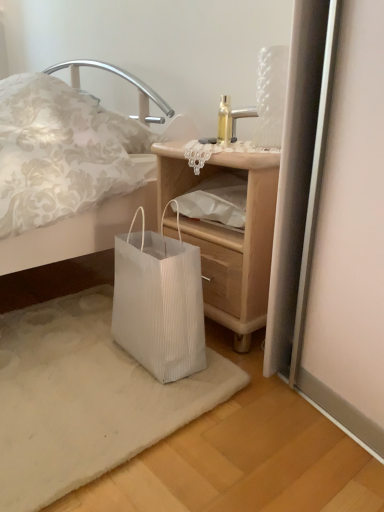
Image resolution: width=384 pixels, height=512 pixels. What do you see at coordinates (159, 303) in the screenshot?
I see `white paper bag at lower left` at bounding box center [159, 303].

Where is `white pleated paper bag at lower left`? This screenshot has height=512, width=384. white pleated paper bag at lower left is located at coordinates (84, 399).

Locate an element on the screen. The height and width of the screenshot is (512, 384). white paper bag at lower left is located at coordinates (159, 303).

From the picture: From a real-world perspective, is white paper bag at lower left physically above white pleated paper bag at lower left?

Yes, from a real-world perspective, white paper bag at lower left is on top of white pleated paper bag at lower left.

From the image's perspective, is white paper bag at lower left above or below white pleated paper bag at lower left?

white paper bag at lower left is above white pleated paper bag at lower left.

From the picture: Does white paper bag at lower left appear on the right side of white pleated paper bag at lower left?

Yes, white paper bag at lower left is to the right of white pleated paper bag at lower left.

Based on the photo, which is in front, white paper bag at lower left or white pleated paper bag at lower left?

Positioned in front is white pleated paper bag at lower left.

You are a GUI agent. You are given a task and a screenshot of the screen. Output one action in this format:
    pyautogui.click(x=<x>, y=<y>)
    Task: Click on the nightstand that is behind the white paper bag at lower left
    This screenshot has width=384, height=512.
    Given the screenshot: What is the action you would take?
    pyautogui.click(x=228, y=234)

Are white paper bag at lower left and wooden nightstand at lower center located far from each other?

They are positioned close to each other.

From a real-world perspective, is white paper bag at lower left physically located above or below wooden nightstand at lower center?

From a real-world perspective, white paper bag at lower left is physically below wooden nightstand at lower center.

How far apart are white paper bag at lower left and wooden nightstand at lower center?

7.53 inches.

In the scene shown: How far apart are white pleated paper bag at lower left and wooden nightstand at lower center?

They are 14.49 inches apart.

From a real-world perspective, is white pleated paper bag at lower left under wooden nightstand at lower center?

Correct, in the physical world, white pleated paper bag at lower left is lower than wooden nightstand at lower center.

From the picture: Considering the sizes of objects white pleated paper bag at lower left and wooden nightstand at lower center in the image provided, who is taller, white pleated paper bag at lower left or wooden nightstand at lower center?

wooden nightstand at lower center.

In the scene shown: Considering the relative positions of white pleated paper bag at lower left and wooden nightstand at lower center in the image provided, is white pleated paper bag at lower left in front of wooden nightstand at lower center?

Yes, white pleated paper bag at lower left is closer to the viewer.

Is wooden nightstand at lower center closer to camera compared to white pleated paper bag at lower left?

No, the depth of wooden nightstand at lower center is greater than that of white pleated paper bag at lower left.

Is wooden nightstand at lower center facing towards white pleated paper bag at lower left?

Yes, wooden nightstand at lower center is turned towards white pleated paper bag at lower left.

Which object is positioned more to the right, wooden nightstand at lower center or white pleated paper bag at lower left?

wooden nightstand at lower center.

Are wooden nightstand at lower center and white paper bag at lower left far apart?

No, wooden nightstand at lower center is in close proximity to white paper bag at lower left.

Would you say wooden nightstand at lower center is outside white paper bag at lower left?

Absolutely, wooden nightstand at lower center is external to white paper bag at lower left.

From a real-world perspective, is wooden nightstand at lower center physically located above or below white paper bag at lower left?

In terms of real-world spatial position, wooden nightstand at lower center is above white paper bag at lower left.

Between point (101, 434) and point (159, 380), which one is positioned behind?

The point (159, 380) is behind.

Can you tell me how much white pleated paper bag at lower left and white paper bag at lower left differ in facing direction?

The facing directions of white pleated paper bag at lower left and white paper bag at lower left are 91.3 degrees apart.

From the image's perspective, would you say white pleated paper bag at lower left is shown under white paper bag at lower left?

Yes, from the image's perspective, white pleated paper bag at lower left is below white paper bag at lower left.

At what (x,y) coordinates should I click in order to perform the action: click on bag located above the white pleated paper bag at lower left (from the image's perspective). Please return your answer as a coordinate pair (x, y). The height and width of the screenshot is (512, 384). Looking at the image, I should click on (159, 303).

Locate an element on the screen. nightstand above the white paper bag at lower left (from a real-world perspective) is located at coordinates (228, 234).

Based on their spatial positions, is white pleated paper bag at lower left or wooden nightstand at lower center closer to white paper bag at lower left?

Based on the image, white pleated paper bag at lower left appears to be nearer to white paper bag at lower left.

Consider the image. Which object lies nearer to the anchor point white pleated paper bag at lower left, wooden nightstand at lower center or white paper bag at lower left?

white paper bag at lower left lies closer to white pleated paper bag at lower left than the other object.

Which object lies further to the anchor point white paper bag at lower left, wooden nightstand at lower center or white pleated paper bag at lower left?

The object further to white paper bag at lower left is wooden nightstand at lower center.

When comparing their distances from white pleated paper bag at lower left, does white paper bag at lower left or wooden nightstand at lower center seem closer?

Among the two, white paper bag at lower left is located nearer to white pleated paper bag at lower left.

When comparing their distances from wooden nightstand at lower center, does white paper bag at lower left or white pleated paper bag at lower left seem closer?

white paper bag at lower left.

Looking at the image, which one is located closer to wooden nightstand at lower center, white pleated paper bag at lower left or white paper bag at lower left?

The object closer to wooden nightstand at lower center is white paper bag at lower left.

This screenshot has height=512, width=384. I want to click on bag situated between white pleated paper bag at lower left and wooden nightstand at lower center from left to right, so click(159, 303).